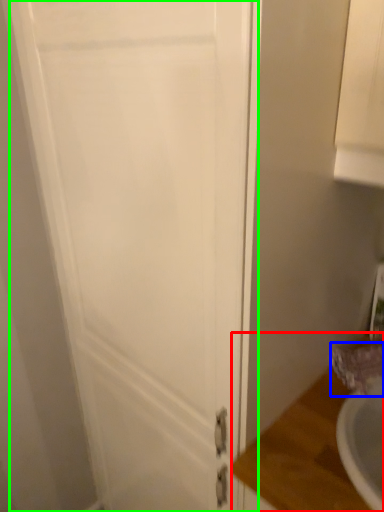
Question: Estimate the real-world distances between objects in this image. Which object is farther from counter top (highlighted by a red box), faucet (highlighted by a blue box) or door (highlighted by a green box)?

Choices:
 (A) faucet
 (B) door

Answer: (B)